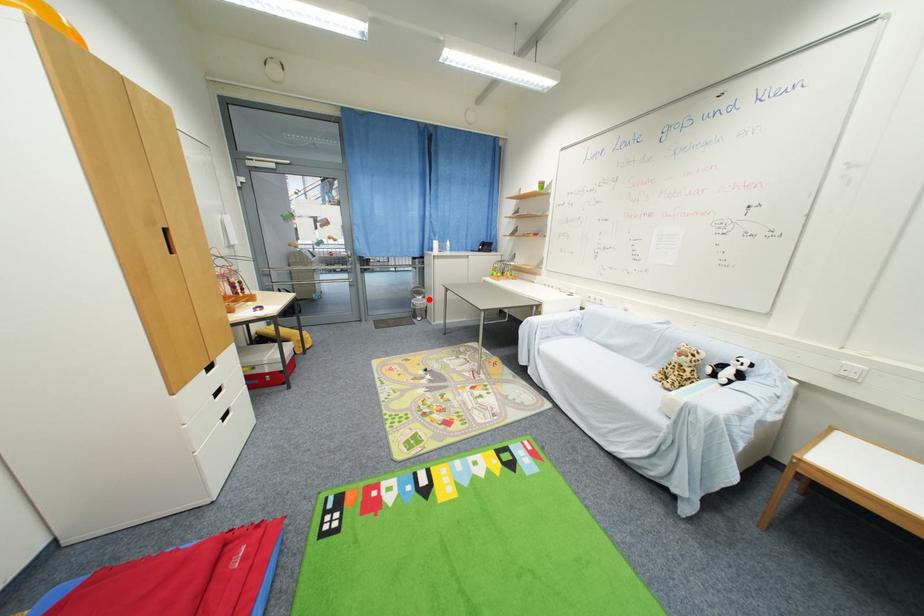
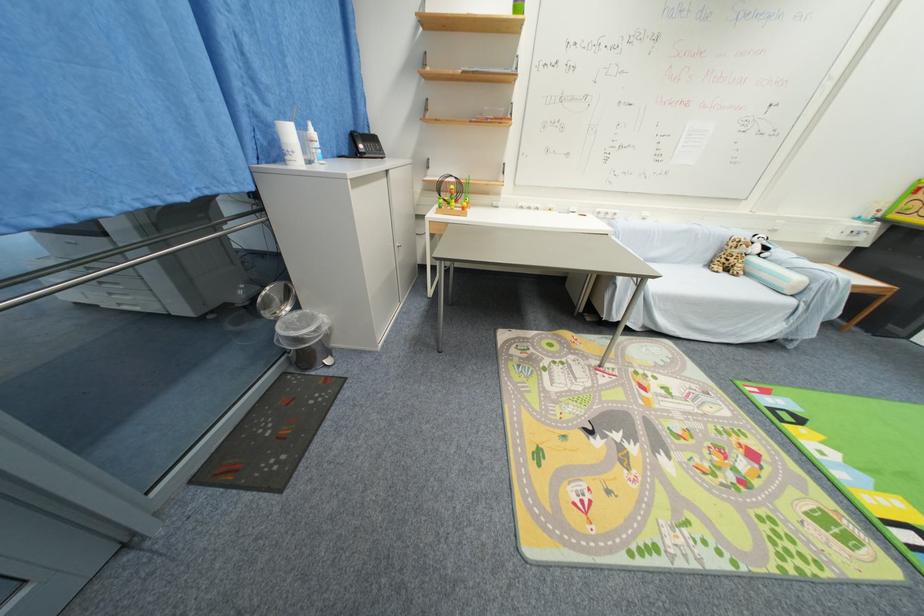
In the second image, find the point that corresponds to the highlighted location in the first image.

(301, 309)